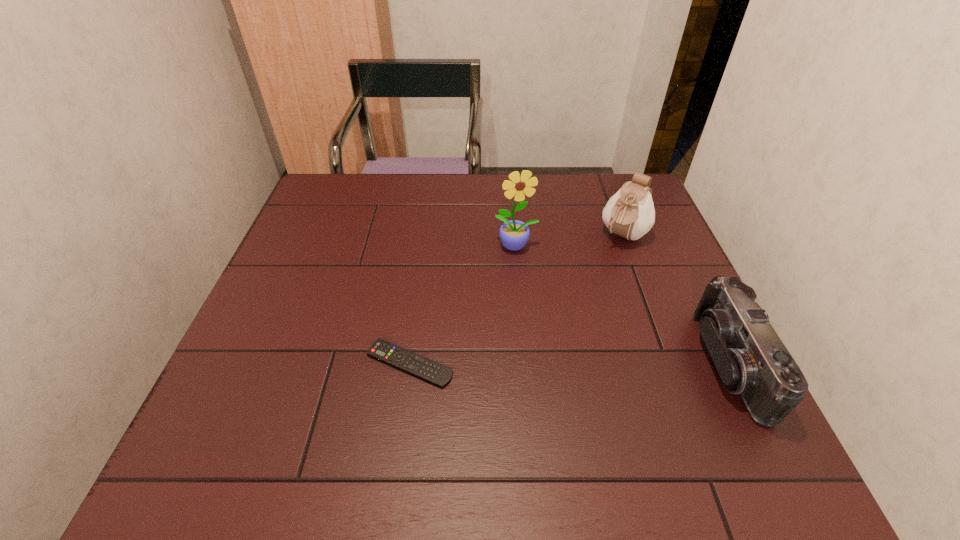
Locate an element on the screen. The height and width of the screenshot is (540, 960). the shortest object is located at coordinates (439, 375).

The image size is (960, 540). What are the coordinates of `remote control` in the screenshot? It's located at click(x=439, y=375).

This screenshot has height=540, width=960. I want to click on camcorder, so click(751, 359).

You are a GUI agent. You are given a task and a screenshot of the screen. Output one action in this format:
    pyautogui.click(x=<x>, y=<y>)
    Task: Click on the rightmost object
    
    Given the screenshot: What is the action you would take?
    pyautogui.click(x=751, y=359)

Find the location of `the second object from right to left`. the second object from right to left is located at coordinates click(x=630, y=213).

You are a GUI agent. You are given a task and a screenshot of the screen. Output one action in this format:
    pyautogui.click(x=<x>, y=<y>)
    Task: Click on the third shortest object
    
    Given the screenshot: What is the action you would take?
    pyautogui.click(x=630, y=213)

Locate an element on the screen. This screenshot has width=960, height=540. sunflower is located at coordinates (514, 234).

The image size is (960, 540). I want to click on the tallest object, so click(514, 234).

In order to click on free space located 0.230m on the left of the remote control in this screenshot , I will do `click(256, 363)`.

I want to click on free region located 0.170m on the front-facing side of the rightmost object, so click(623, 363).